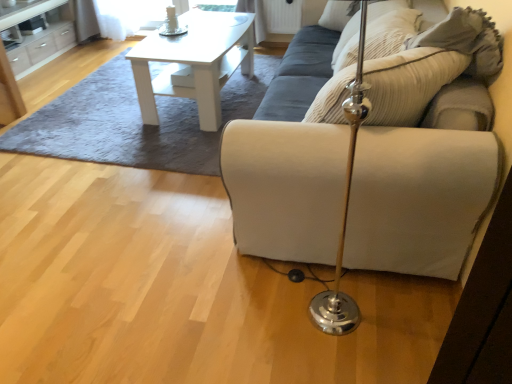
The image size is (512, 384). In order to click on blank space to the left of white matte table at upper center in this screenshot , I will do `click(95, 108)`.